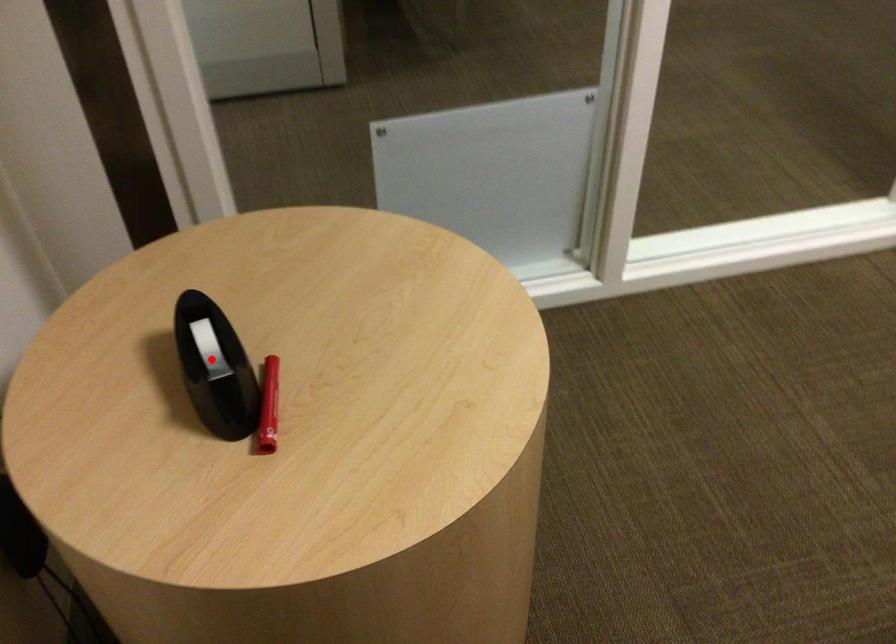
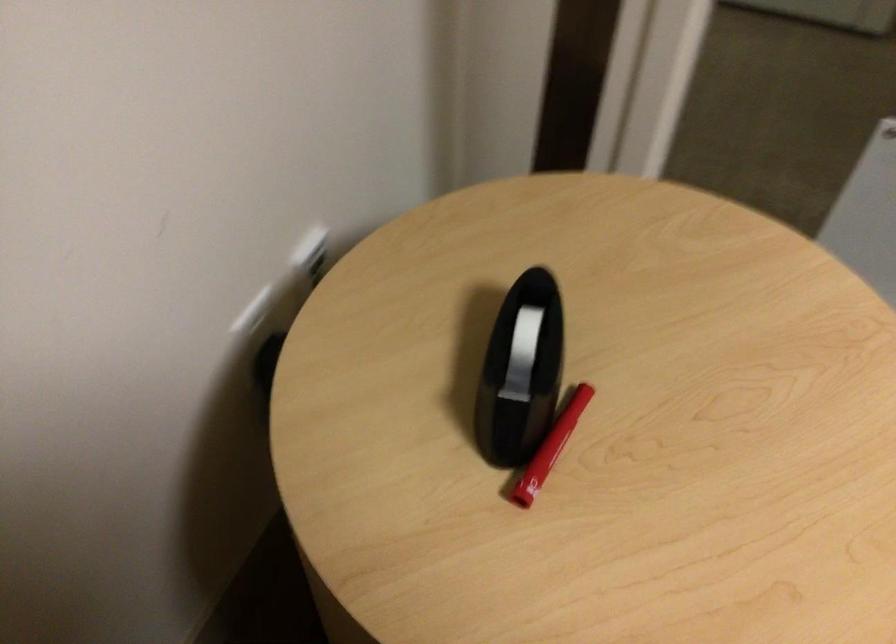
Locate, in the second image, the point that corresponds to the highlighted location in the first image.

(521, 354)